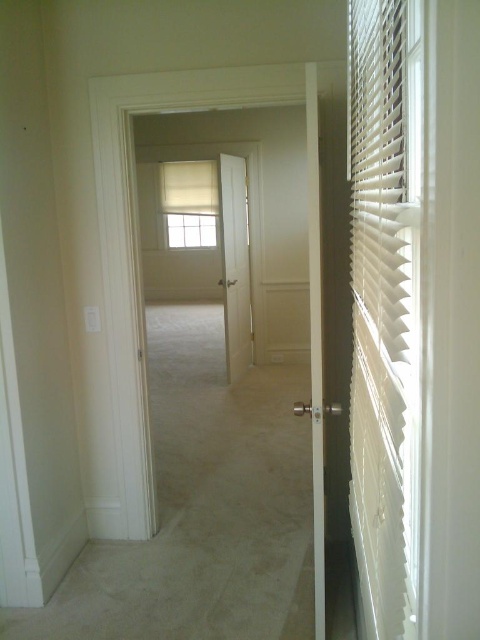
Question: Which object appears closest to the camera in this image?

Choices:
 (A) white matte window at center
 (B) white plastic blinds at right

Answer: (B)

Question: Which of the following is the farthest from the observer?

Choices:
 (A) white smooth door at center
 (B) white plastic blinds at right

Answer: (A)

Question: Is white plastic blinds at right smaller than white smooth door at center?

Choices:
 (A) no
 (B) yes

Answer: (B)

Question: Is white plastic blinds at right positioned behind white smooth door at center?

Choices:
 (A) yes
 (B) no

Answer: (B)

Question: Is white plastic blinds at right below white matte window at center?

Choices:
 (A) no
 (B) yes

Answer: (B)

Question: Which object appears closest to the camera in this image?

Choices:
 (A) white matte window at center
 (B) white smooth door at center

Answer: (B)